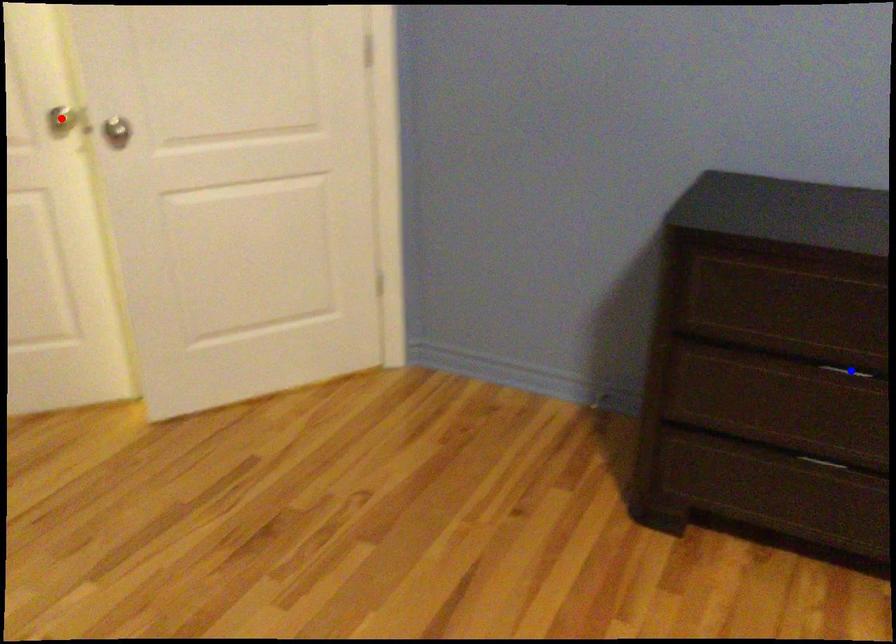
Question: Two points are marked on the image. Which point is closer to the camera?

Choices:
 (A) Blue point is closer.
 (B) Red point is closer.

Answer: (A)